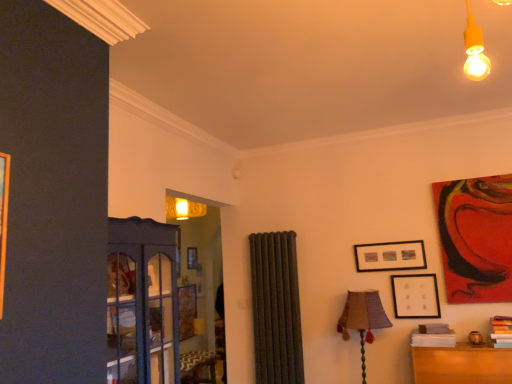
The height and width of the screenshot is (384, 512). Describe the element at coordinates (502, 331) in the screenshot. I see `hardcover book at lower right, placed as the 1th book when sorted from right to left` at that location.

The height and width of the screenshot is (384, 512). In order to click on red glossy painting at upper right, arranged as the third picture frame when viewed from the left in this screenshot , I will do `click(476, 238)`.

Identify the location of black matte picture frame at upper right, marked as the first picture frame in a left-to-right arrangement. The image size is (512, 384). [390, 256].

From the image's perspective, is matte black picture frame at lower right, the second picture frame viewed from the left, below burlap lampshade at center-right?

No, from the image's perspective, matte black picture frame at lower right, the second picture frame viewed from the left, is not below burlap lampshade at center-right.

Considering the sizes of matte black picture frame at lower right, marked as the second picture frame in a right-to-left arrangement, and burlap lampshade at center-right in the image, is matte black picture frame at lower right, marked as the second picture frame in a right-to-left arrangement, taller or shorter than burlap lampshade at center-right?

In the image, matte black picture frame at lower right, marked as the second picture frame in a right-to-left arrangement, appears to be shorter than burlap lampshade at center-right.

From a real-world perspective, does matte black picture frame at lower right, marked as the second picture frame in a right-to-left arrangement, stand above burlap lampshade at center-right?

Indeed, from a real-world perspective, matte black picture frame at lower right, marked as the second picture frame in a right-to-left arrangement, stands above burlap lampshade at center-right.

Is matte black picture frame at lower right, the second picture frame viewed from the left, far from burlap lampshade at center-right?

That's not correct — matte black picture frame at lower right, the second picture frame viewed from the left, is a little close to burlap lampshade at center-right.

Considering the positions of objects white paper at lower right, which is the 2th book in right-to-left order, and hardcover book at lower right, which is counted as the second book, starting from the left, in the image provided, who is more to the right, white paper at lower right, which is the 2th book in right-to-left order, or hardcover book at lower right, which is counted as the second book, starting from the left,?

From the viewer's perspective, hardcover book at lower right, which is counted as the second book, starting from the left, appears more on the right side.

Who is smaller, white paper at lower right, arranged as the first book when viewed from the left, or hardcover book at lower right, which is counted as the second book, starting from the left?

With smaller size is white paper at lower right, arranged as the first book when viewed from the left.

How many degrees apart are the facing directions of white paper at lower right, which is the 2th book in right-to-left order, and hardcover book at lower right, which is counted as the second book, starting from the left?

The facing directions of white paper at lower right, which is the 2th book in right-to-left order, and hardcover book at lower right, which is counted as the second book, starting from the left, are 3.66 degrees apart.

From the image's perspective, between white paper at lower right, arranged as the first book when viewed from the left, and hardcover book at lower right, which is counted as the second book, starting from the left, which one is located above?

hardcover book at lower right, which is counted as the second book, starting from the left, appears higher in the image.

I want to click on the 1st picture frame above when counting from the hardcover book at lower right, which is counted as the second book, starting from the left (from the image's perspective), so [x=415, y=296].

Choose the correct answer: Is hardcover book at lower right, which is counted as the second book, starting from the left, inside matte black picture frame at lower right, the second picture frame viewed from the left, or outside it?

hardcover book at lower right, which is counted as the second book, starting from the left, is outside matte black picture frame at lower right, the second picture frame viewed from the left.

Is white paper at lower right, which is the 2th book in right-to-left order, inside or outside of black matte picture frame at upper right, which is counted as the third picture frame, starting from the right?

white paper at lower right, which is the 2th book in right-to-left order, is located beyond the bounds of black matte picture frame at upper right, which is counted as the third picture frame, starting from the right.

Can you tell me how much white paper at lower right, which is the 2th book in right-to-left order, and black matte picture frame at upper right, marked as the first picture frame in a left-to-right arrangement, differ in facing direction?

There is a 0.276-degree angle between the facing directions of white paper at lower right, which is the 2th book in right-to-left order, and black matte picture frame at upper right, marked as the first picture frame in a left-to-right arrangement.

From the white paper at lower right, which is the 2th book in right-to-left order, count the 2nd picture frame to the left and point to it. Please provide its 2D coordinates.

[(390, 256)]

Does red glossy painting at upper right, the first picture frame from the right, appear on the left side of matte black picture frame at lower right, the second picture frame viewed from the left?

Incorrect, red glossy painting at upper right, the first picture frame from the right, is not on the left side of matte black picture frame at lower right, the second picture frame viewed from the left.

Considering the points (505, 189) and (402, 298), which point is behind, point (505, 189) or point (402, 298)?

The point (402, 298) is farther from the camera.

Considering the sizes of red glossy painting at upper right, arranged as the third picture frame when viewed from the left, and matte black picture frame at lower right, marked as the second picture frame in a right-to-left arrangement, in the image, is red glossy painting at upper right, arranged as the third picture frame when viewed from the left, bigger or smaller than matte black picture frame at lower right, marked as the second picture frame in a right-to-left arrangement,?

Clearly, red glossy painting at upper right, arranged as the third picture frame when viewed from the left, is larger in size than matte black picture frame at lower right, marked as the second picture frame in a right-to-left arrangement.

Is red glossy painting at upper right, arranged as the third picture frame when viewed from the left, situated inside matte black picture frame at lower right, the second picture frame viewed from the left, or outside?

red glossy painting at upper right, arranged as the third picture frame when viewed from the left, is located beyond the bounds of matte black picture frame at lower right, the second picture frame viewed from the left.

Is black matte picture frame at upper right, marked as the first picture frame in a left-to-right arrangement, beside matte black picture frame at lower right, the second picture frame viewed from the left?

No, black matte picture frame at upper right, marked as the first picture frame in a left-to-right arrangement, is not making contact with matte black picture frame at lower right, the second picture frame viewed from the left.

From the image's perspective, is black matte picture frame at upper right, which is counted as the third picture frame, starting from the right, over matte black picture frame at lower right, the second picture frame viewed from the left?

Yes, from the image's perspective, black matte picture frame at upper right, which is counted as the third picture frame, starting from the right, is above matte black picture frame at lower right, the second picture frame viewed from the left.

Between black matte picture frame at upper right, marked as the first picture frame in a left-to-right arrangement, and matte black picture frame at lower right, the second picture frame viewed from the left, which one is positioned in front?

matte black picture frame at lower right, the second picture frame viewed from the left, is closer to the camera.

How many degrees apart are the facing directions of black matte picture frame at upper right, marked as the first picture frame in a left-to-right arrangement, and matte black picture frame at lower right, marked as the second picture frame in a right-to-left arrangement?

There is a 0.659-degree angle between the facing directions of black matte picture frame at upper right, marked as the first picture frame in a left-to-right arrangement, and matte black picture frame at lower right, marked as the second picture frame in a right-to-left arrangement.

Is hardcover book at lower right, placed as the 1th book when sorted from right to left, placed right next to red glossy painting at upper right, the first picture frame from the right?

No, hardcover book at lower right, placed as the 1th book when sorted from right to left, is not making contact with red glossy painting at upper right, the first picture frame from the right.

From the image's perspective, is hardcover book at lower right, placed as the 1th book when sorted from right to left, above or below red glossy painting at upper right, the first picture frame from the right?

Clearly, from the image's perspective, hardcover book at lower right, placed as the 1th book when sorted from right to left, is below red glossy painting at upper right, the first picture frame from the right.

Between hardcover book at lower right, which is counted as the second book, starting from the left, and red glossy painting at upper right, arranged as the third picture frame when viewed from the left, which one has more height?

With more height is red glossy painting at upper right, arranged as the third picture frame when viewed from the left.

What's the angular difference between hardcover book at lower right, which is counted as the second book, starting from the left, and red glossy painting at upper right, arranged as the third picture frame when viewed from the left,'s facing directions?

The angle between the facing direction of hardcover book at lower right, which is counted as the second book, starting from the left, and the facing direction of red glossy painting at upper right, arranged as the third picture frame when viewed from the left, is 4.96 degrees.

Locate an element on the screen. table lamp that appears in front of the matte black picture frame at lower right, marked as the second picture frame in a right-to-left arrangement is located at coordinates click(x=362, y=319).

What are the coordinates of `book that appears above the white paper at lower right, arranged as the first book when viewed from the left (from the image's perspective)` in the screenshot? It's located at (502, 331).

Considering their positions, is burlap lampshade at center-right positioned closer to white paper at lower right, which is the 2th book in right-to-left order, than black matte picture frame at upper right, which is counted as the third picture frame, starting from the right?

burlap lampshade at center-right lies closer to white paper at lower right, which is the 2th book in right-to-left order, than the other object.

Based on their spatial positions, is hardcover book at lower right, placed as the 1th book when sorted from right to left, or matte black picture frame at lower right, the second picture frame viewed from the left, further from white paper at lower right, which is the 2th book in right-to-left order?

hardcover book at lower right, placed as the 1th book when sorted from right to left.

Which object lies nearer to the anchor point red glossy painting at upper right, arranged as the third picture frame when viewed from the left, white paper at lower right, which is the 2th book in right-to-left order, or burlap lampshade at center-right?

The object closer to red glossy painting at upper right, arranged as the third picture frame when viewed from the left, is white paper at lower right, which is the 2th book in right-to-left order.

From the image, which object appears to be farther from hardcover book at lower right, which is counted as the second book, starting from the left, white paper at lower right, which is the 2th book in right-to-left order, or red glossy painting at upper right, arranged as the third picture frame when viewed from the left?

red glossy painting at upper right, arranged as the third picture frame when viewed from the left.

Looking at the image, which one is located further to burlap lampshade at center-right, black matte picture frame at upper right, marked as the first picture frame in a left-to-right arrangement, or matte black picture frame at lower right, marked as the second picture frame in a right-to-left arrangement?

Based on the image, black matte picture frame at upper right, marked as the first picture frame in a left-to-right arrangement, appears to be further to burlap lampshade at center-right.

Looking at the image, which one is located further to red glossy painting at upper right, arranged as the third picture frame when viewed from the left, matte black picture frame at lower right, the second picture frame viewed from the left, or hardcover book at lower right, placed as the 1th book when sorted from right to left?

Based on the image, hardcover book at lower right, placed as the 1th book when sorted from right to left, appears to be further to red glossy painting at upper right, arranged as the third picture frame when viewed from the left.

From the image, which object appears to be farther from red glossy painting at upper right, arranged as the third picture frame when viewed from the left, black matte picture frame at upper right, marked as the first picture frame in a left-to-right arrangement, or matte black picture frame at lower right, marked as the second picture frame in a right-to-left arrangement?

black matte picture frame at upper right, marked as the first picture frame in a left-to-right arrangement, is further to red glossy painting at upper right, arranged as the third picture frame when viewed from the left.

From the image, which object appears to be farther from white paper at lower right, arranged as the first book when viewed from the left, matte black picture frame at lower right, the second picture frame viewed from the left, or burlap lampshade at center-right?

burlap lampshade at center-right.

Find the location of a particular element. The width and height of the screenshot is (512, 384). picture frame between black matte picture frame at upper right, which is counted as the third picture frame, starting from the right, and white paper at lower right, arranged as the first book when viewed from the left, vertically is located at coordinates (415, 296).

Where is `book between matte black picture frame at lower right, the second picture frame viewed from the left, and hardcover book at lower right, placed as the 1th book when sorted from right to left`? The height and width of the screenshot is (384, 512). book between matte black picture frame at lower right, the second picture frame viewed from the left, and hardcover book at lower right, placed as the 1th book when sorted from right to left is located at coordinates (433, 336).

Identify the location of picture frame between black matte picture frame at upper right, which is counted as the third picture frame, starting from the right, and red glossy painting at upper right, the first picture frame from the right, from left to right. point(415,296).

The image size is (512, 384). What are the coordinates of `book between burlap lampshade at center-right and red glossy painting at upper right, arranged as the third picture frame when viewed from the left, from left to right` in the screenshot? It's located at (433, 336).